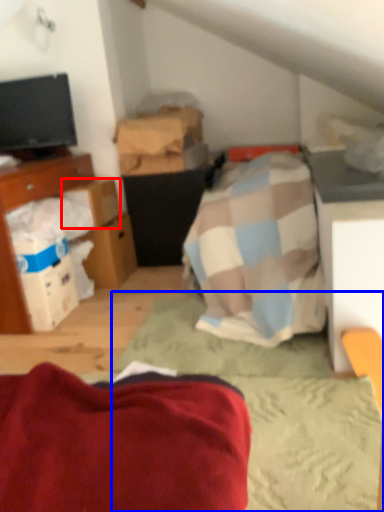
Question: Which of the following is the farthest to the observer, cardboard box (highlighted by a red box) or bed frame (highlighted by a blue box)?

Choices:
 (A) cardboard box
 (B) bed frame

Answer: (A)